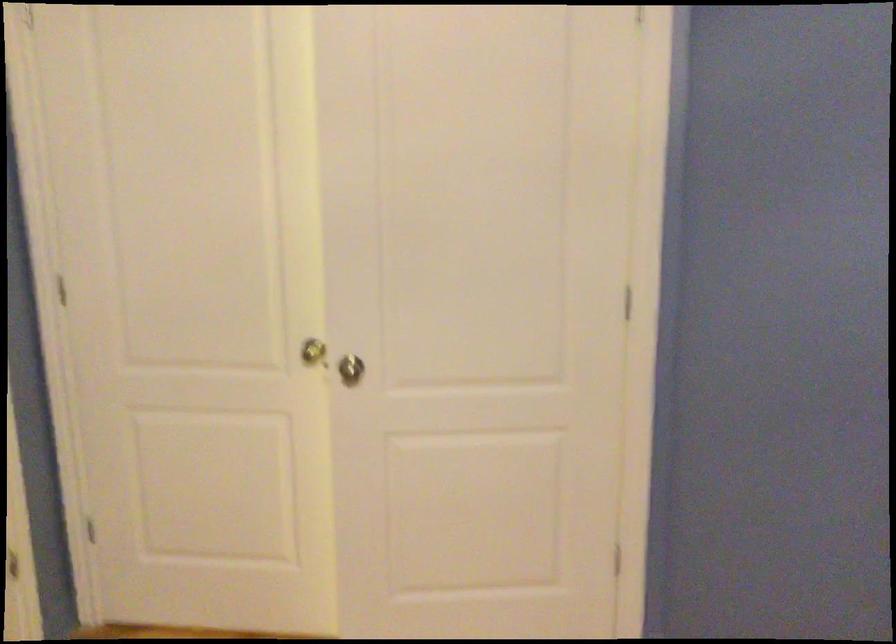
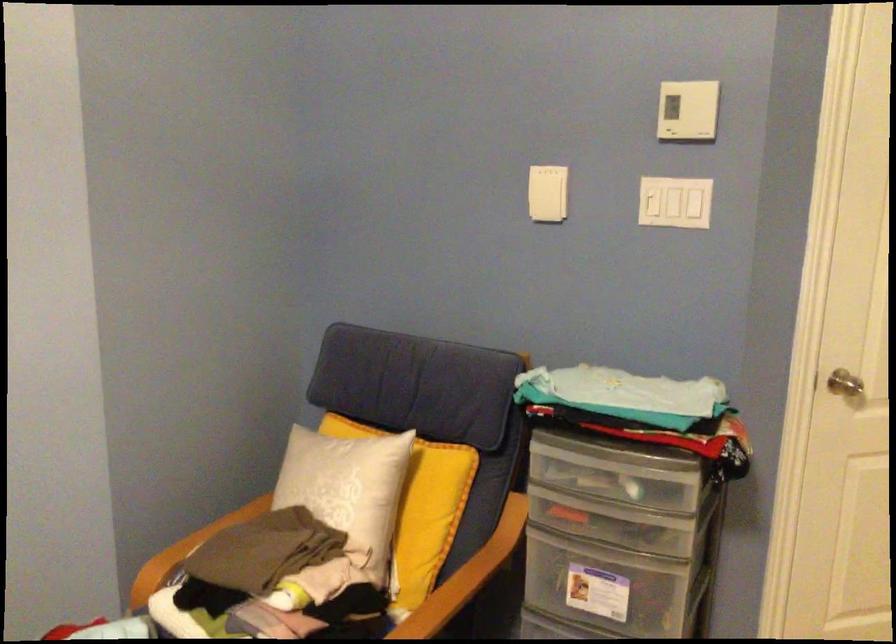
Question: How did the camera likely rotate?

Choices:
 (A) Left
 (B) Right
 (C) Up
 (D) Down

Answer: (A)